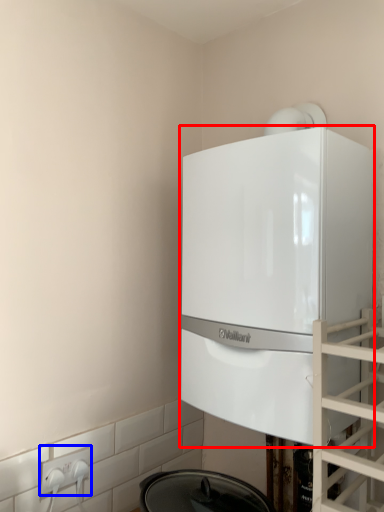
Question: Which of the following is the closest to the observer, home appliance (highlighted by a red box) or electric outlet (highlighted by a blue box)?

Choices:
 (A) home appliance
 (B) electric outlet

Answer: (A)